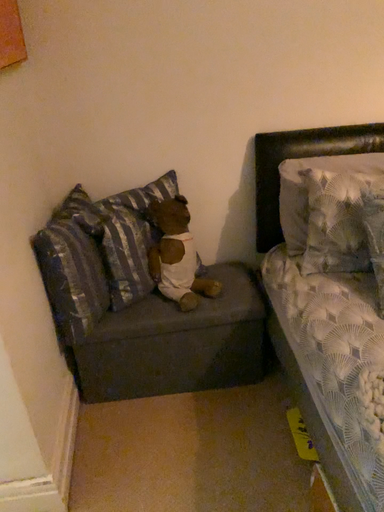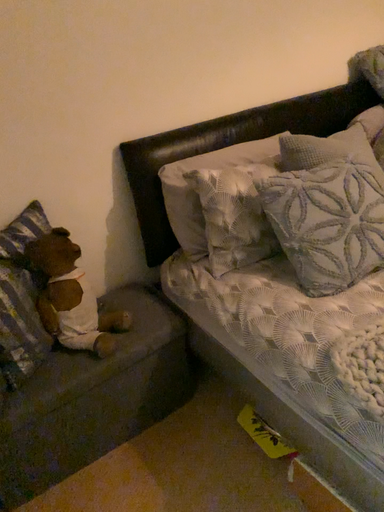
Question: Which way did the camera rotate in the video?

Choices:
 (A) rotated left
 (B) rotated right

Answer: (B)